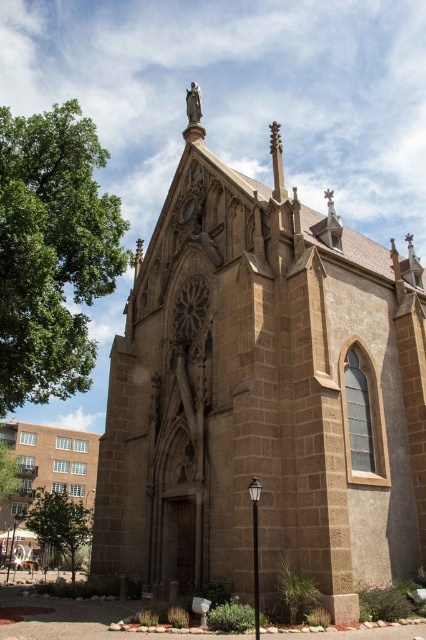
Who is shorter, brown stone church at center or green leafy tree at lower left?

Standing shorter between the two is green leafy tree at lower left.

Is point (150, 560) less distant than point (48, 515)?

That is True.

Between point (244, 576) and point (69, 554), which one is positioned in front?

Point (244, 576)

Where is `brown stone church at center`? This screenshot has height=640, width=426. brown stone church at center is located at coordinates (262, 394).

Is point (319, 298) farther from viewer compared to point (34, 324)?

No.

This screenshot has height=640, width=426. Find the location of `brown stone church at center`. brown stone church at center is located at coordinates (262, 394).

Is green leafy tree at upper left bigger than green leafy tree at lower left?

Indeed, green leafy tree at upper left has a larger size compared to green leafy tree at lower left.

Between point (120, 220) and point (48, 540), which one is positioned behind?

The point (48, 540) is more distant.

The height and width of the screenshot is (640, 426). I want to click on green leafy tree at upper left, so click(51, 252).